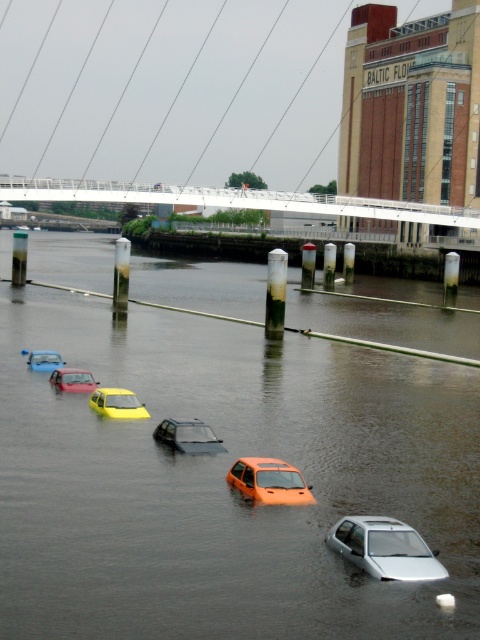
Question: Which point is farther from the camera taking this photo?

Choices:
 (A) (93, 392)
 (B) (84, 380)
 (C) (36, 195)
 (D) (273, 470)

Answer: (C)

Question: Considering the real-world distances, which object is farthest from the metallic silver car at lower center?

Choices:
 (A) yellow matte car at center
 (B) smooth water at center

Answer: (B)

Question: Can you confirm if smooth water at center is positioned to the right of yellow matte car at center?

Choices:
 (A) yes
 (B) no

Answer: (A)

Question: Does orange matte car at center appear over metallic silver car at lower center?

Choices:
 (A) no
 (B) yes

Answer: (A)

Question: Can you confirm if white metallic bridge at upper center is positioned above white matte car at lower right?

Choices:
 (A) no
 (B) yes

Answer: (B)

Question: Which of these objects is positioned farthest from the white matte car at lower right?

Choices:
 (A) metallic silver car at lower center
 (B) white metallic bridge at upper center
 (C) metallic silver car at lower left

Answer: (B)